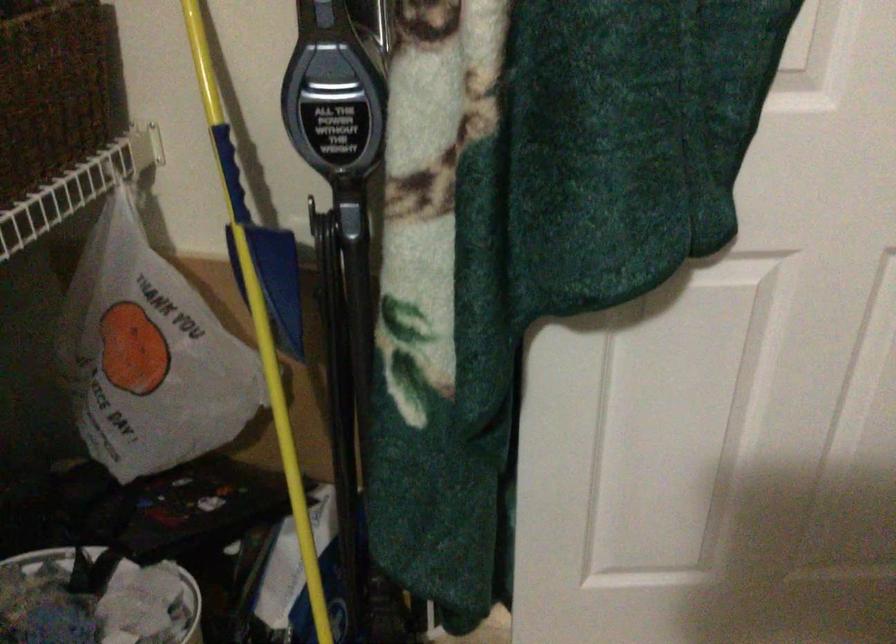
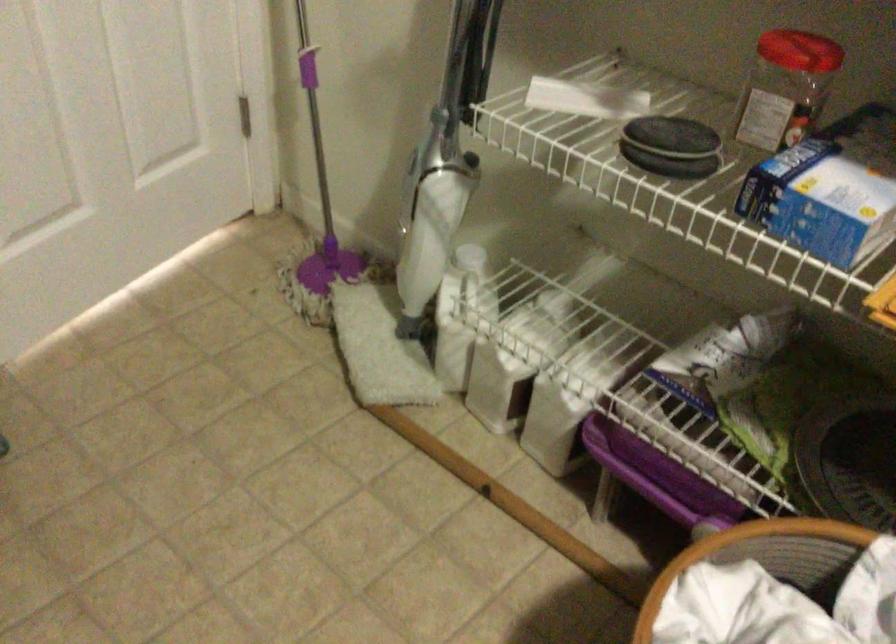
From the picture: The first image is from the beginning of the video and the second image is from the end. How did the camera likely rotate when shooting the video?

The rotation direction of the camera is right-down.